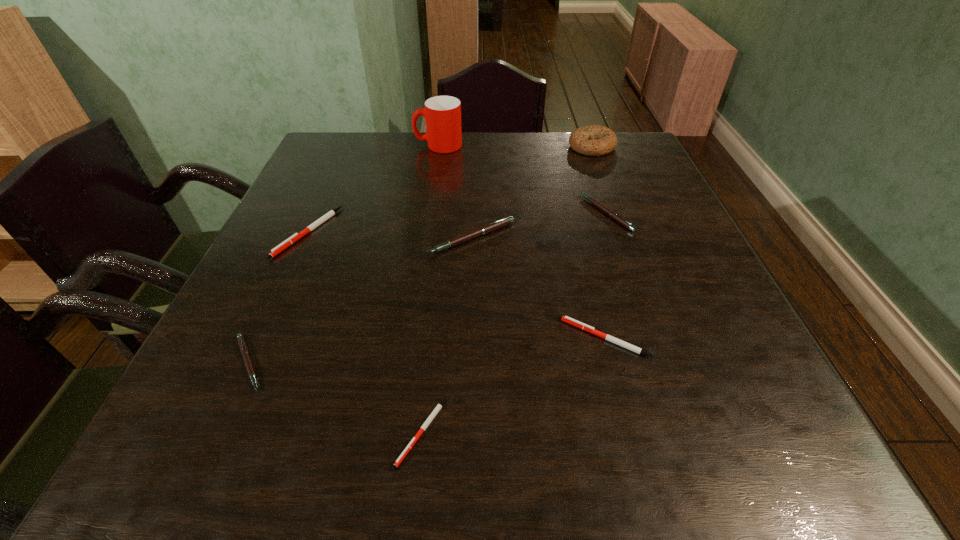
Where is `free space between the rightmost pink pen and the red cup`? free space between the rightmost pink pen and the red cup is located at coordinates (522, 179).

You are a GUI agent. You are given a task and a screenshot of the screen. Output one action in this format:
    pyautogui.click(x=<x>, y=<y>)
    Task: Click on the vacant area that lies between the second smallest pink pen and the seventh shortest object
    
    Given the screenshot: What is the action you would take?
    pyautogui.click(x=599, y=180)

Find the location of a particular element. This screenshot has height=540, width=960. free space that is in between the second farthest white pen and the rightmost pink pen is located at coordinates (605, 275).

I want to click on unoccupied position between the biggest white pen and the nearest pen, so click(365, 332).

Find the location of `vacant area between the brown bagel and the smallest pink pen`. vacant area between the brown bagel and the smallest pink pen is located at coordinates (420, 255).

This screenshot has width=960, height=540. What are the coordinates of `unoccupied area between the leftmost white pen and the nearest pen` in the screenshot? It's located at (365, 332).

Find the location of a particular element. vacant point located between the cup and the leftmost pink pen is located at coordinates (343, 254).

I want to click on free space that is in between the smallest pink pen and the second biggest pink pen, so (x=427, y=288).

The width and height of the screenshot is (960, 540). Find the location of `empty location between the leftmost white pen and the tallest object`. empty location between the leftmost white pen and the tallest object is located at coordinates (372, 189).

Locate an element on the screen. vacant region between the second smallest pink pen and the smallest pink pen is located at coordinates (427, 288).